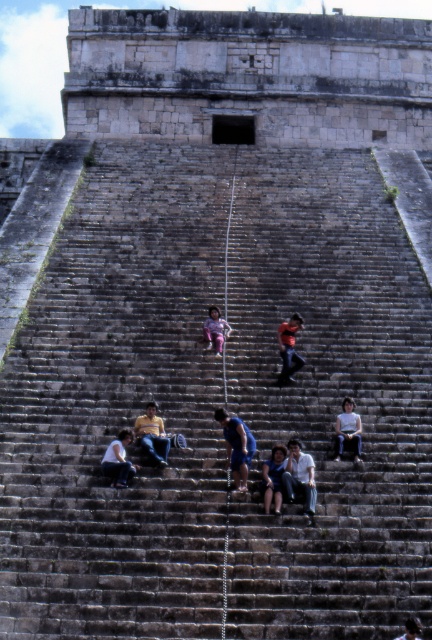
Does light blue jeans at center have a lesser width compared to yellow sweater at center?

Indeed, light blue jeans at center has a lesser width compared to yellow sweater at center.

Is point (308, 497) farther from viewer compared to point (165, 458)?

No, (308, 497) is closer to viewer.

Measure the distance between point (301, 452) and camera.

Point (301, 452) is 40.71 meters from camera.

You are a GUI agent. You are given a task and a screenshot of the screen. Output one action in this format:
    pyautogui.click(x=<x>, y=<y>)
    Task: Click on the light blue jeans at center
    Image resolution: width=432 pixels, height=640 pixels.
    Given the screenshot: What is the action you would take?
    pyautogui.click(x=299, y=476)

Can you confirm if blue denim shorts at center is positioned to the left of blue denim jeans at center?

Indeed, blue denim shorts at center is positioned on the left side of blue denim jeans at center.

Where is `blue denim shorts at center`? Image resolution: width=432 pixels, height=640 pixels. blue denim shorts at center is located at coordinates (237, 445).

At what (x,y) coordinates should I click in order to perform the action: click on blue denim shorts at center. Please return your answer as a coordinate pair (x, y). The width and height of the screenshot is (432, 640). Looking at the image, I should click on (237, 445).

Between light blue jeans at center and white matte shirt at lower center, which one has less height?

white matte shirt at lower center is shorter.

Locate an element on the screen. Image resolution: width=432 pixels, height=640 pixels. light blue jeans at center is located at coordinates (299, 476).